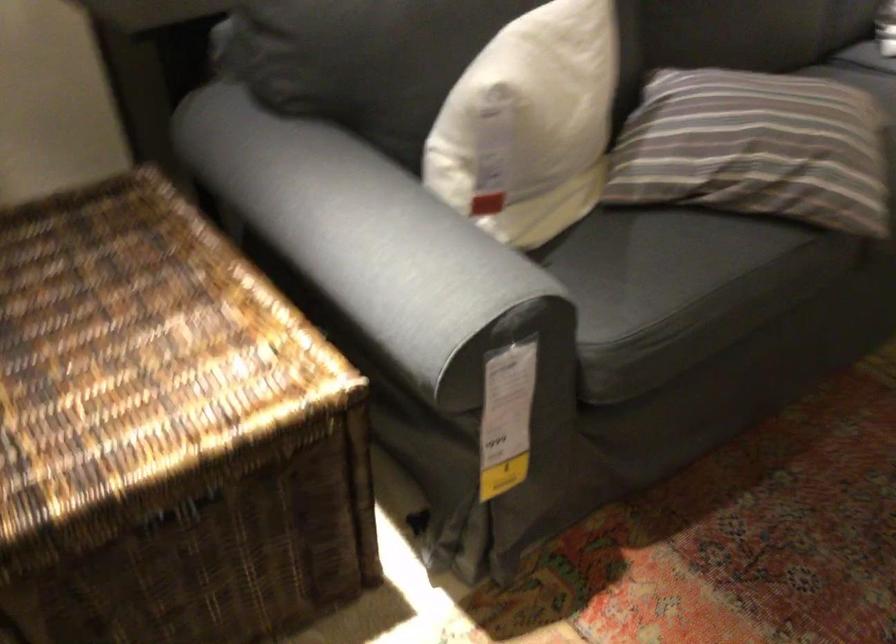
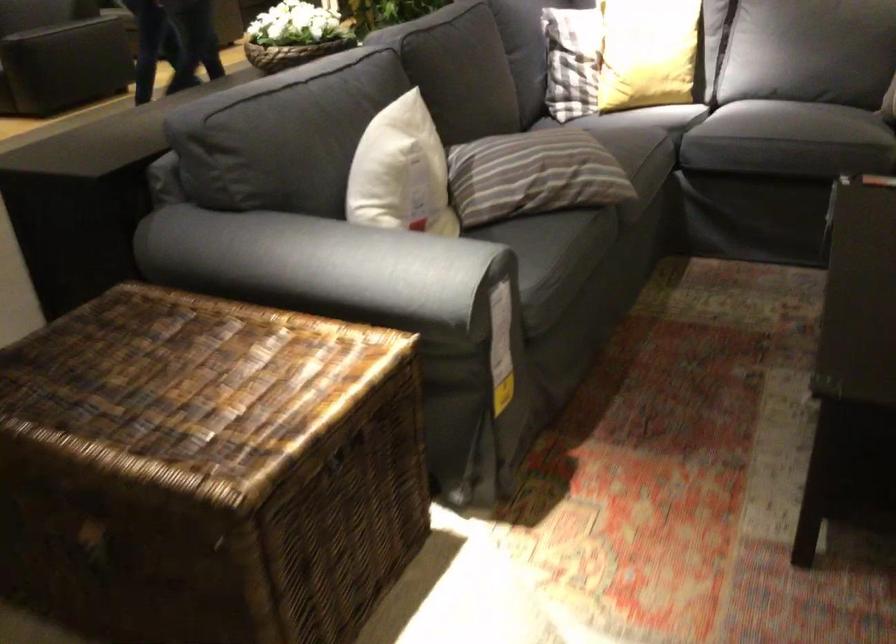
In the second image, find the point that corresponds to (x=73, y=352) in the first image.

(195, 389)